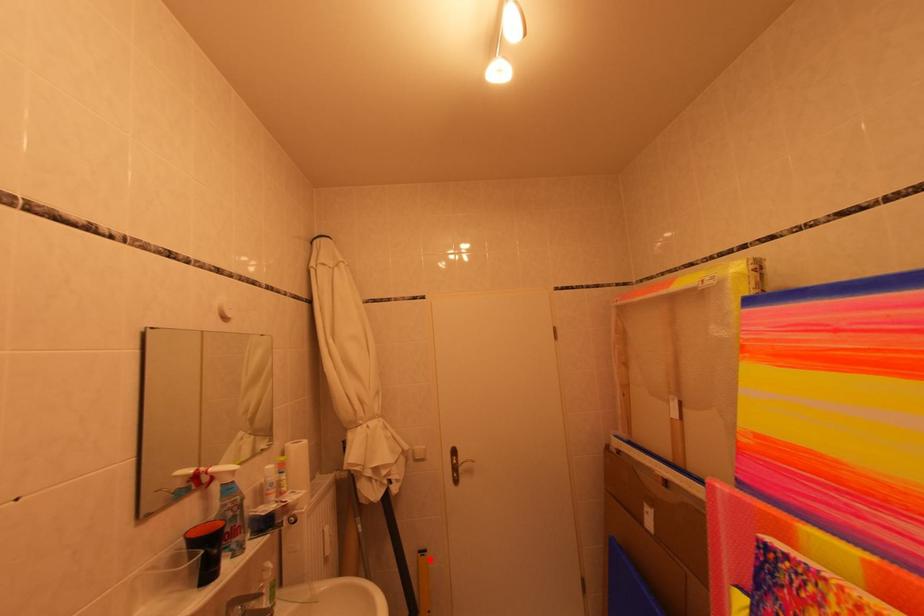
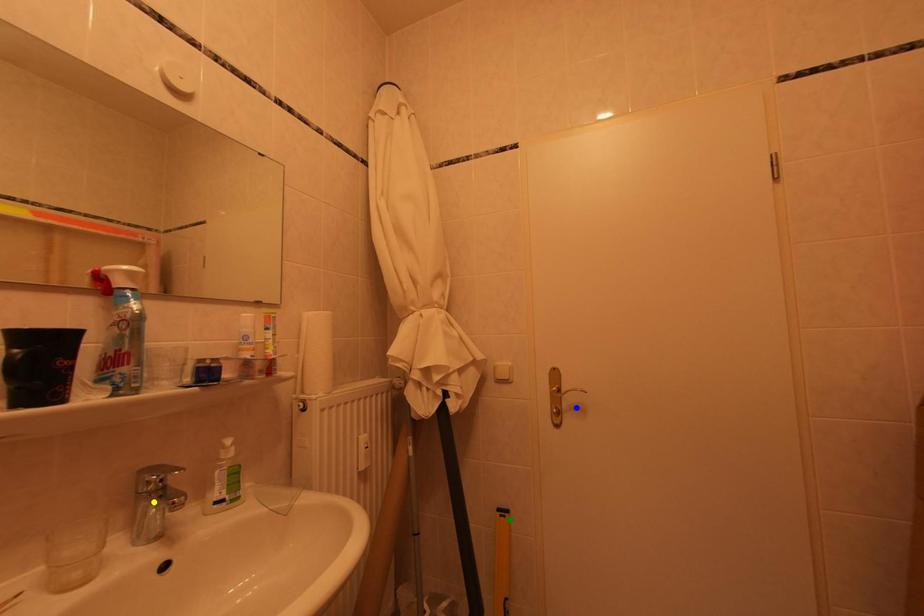
Question: I am providing you with two images of the same scene from different viewpoints. A red point is marked on the first image. You are given multiple points on the second image. Which spot in image 2 lines up with the point in image 1?

Choices:
 (A) green point
 (B) yellow point
 (C) blue point

Answer: (A)